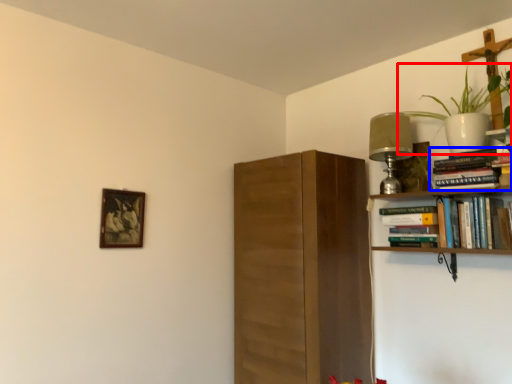
Question: Which point is closer to the camera, houseplant (highlighted by a red box) or book (highlighted by a blue box)?

Choices:
 (A) houseplant
 (B) book

Answer: (A)